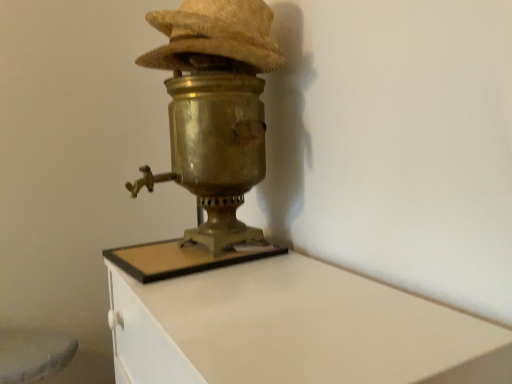
Question: Would you say brass/bronze table lamp at center is part of brass samovar at center's contents?

Choices:
 (A) no
 (B) yes

Answer: (A)

Question: From a real-world perspective, is brass samovar at center positioned over brass/bronze table lamp at center based on gravity?

Choices:
 (A) yes
 (B) no

Answer: (B)

Question: Is brass samovar at center turned away from brass/bronze table lamp at center?

Choices:
 (A) no
 (B) yes

Answer: (A)

Question: From the image's perspective, is brass samovar at center over brass/bronze table lamp at center?

Choices:
 (A) yes
 (B) no

Answer: (B)

Question: Would you consider brass samovar at center to be distant from brass/bronze table lamp at center?

Choices:
 (A) no
 (B) yes

Answer: (A)

Question: Is brass samovar at center taller than brass/bronze table lamp at center?

Choices:
 (A) yes
 (B) no

Answer: (A)

Question: Can you confirm if brass/bronze table lamp at center is taller than woven straw hat at upper center?

Choices:
 (A) yes
 (B) no

Answer: (A)

Question: Does brass/bronze table lamp at center touch woven straw hat at upper center?

Choices:
 (A) yes
 (B) no

Answer: (B)

Question: Would you say brass/bronze table lamp at center is outside woven straw hat at upper center?

Choices:
 (A) yes
 (B) no

Answer: (A)

Question: Considering the relative positions of brass/bronze table lamp at center and woven straw hat at upper center in the image provided, is brass/bronze table lamp at center to the right of woven straw hat at upper center from the viewer's perspective?

Choices:
 (A) yes
 (B) no

Answer: (B)

Question: Considering the relative sizes of brass/bronze table lamp at center and woven straw hat at upper center in the image provided, is brass/bronze table lamp at center smaller than woven straw hat at upper center?

Choices:
 (A) no
 (B) yes

Answer: (A)

Question: Does brass/bronze table lamp at center turn towards woven straw hat at upper center?

Choices:
 (A) no
 (B) yes

Answer: (A)

Question: Can you confirm if brass samovar at center is positioned to the left of woven straw hat at upper center?

Choices:
 (A) yes
 (B) no

Answer: (B)